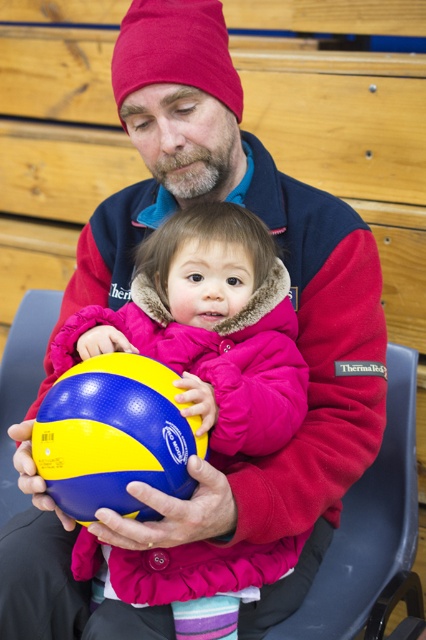
Does matte blue/yellow ball at center come in front of yellow and blue rubber ball at center?

No, it is not.

Does matte blue/yellow ball at center have a lesser height compared to yellow and blue rubber ball at center?

No.

Is point (131, 291) farther from viewer compared to point (161, 369)?

That is True.

Where is `matte blue/yellow ball at center`? The width and height of the screenshot is (426, 640). matte blue/yellow ball at center is located at coordinates (210, 323).